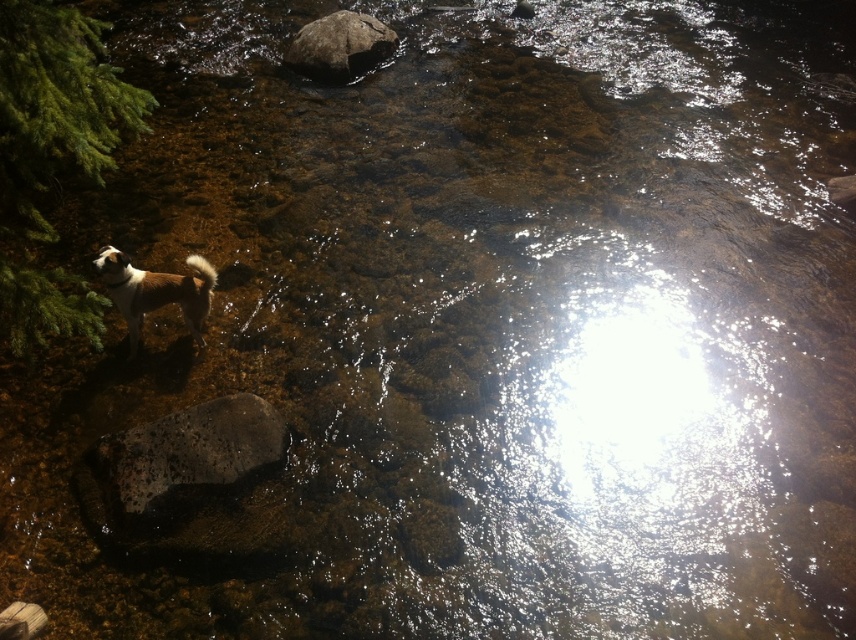
Does speckled gray rock at center have a smaller size compared to brown fur dog at left?

Yes, speckled gray rock at center is smaller than brown fur dog at left.

Which is below, speckled gray rock at center or brown fur dog at left?

speckled gray rock at center is lower down.

You are a GUI agent. You are given a task and a screenshot of the screen. Output one action in this format:
    pyautogui.click(x=<x>, y=<y>)
    Task: Click on the speckled gray rock at center
    Image resolution: width=856 pixels, height=640 pixels.
    Given the screenshot: What is the action you would take?
    pyautogui.click(x=189, y=452)

Which is in front, point (203, 317) or point (300, 56)?

Point (203, 317) is more forward.

Who is positioned more to the left, brown fur dog at left or smooth gray rock at upper center?

From the viewer's perspective, brown fur dog at left appears more on the left side.

What do you see at coordinates (155, 291) in the screenshot? I see `brown fur dog at left` at bounding box center [155, 291].

At what (x,y) coordinates should I click in order to perform the action: click on brown fur dog at left. Please return your answer as a coordinate pair (x, y). Looking at the image, I should click on (155, 291).

Between point (260, 442) and point (363, 19), which one is positioned in front?

Point (260, 442) is in front.

Which of these two, speckled gray rock at center or smooth gray rock at upper center, stands shorter?

With less height is speckled gray rock at center.

Does point (102, 444) come closer to viewer compared to point (308, 33)?

Yes, point (102, 444) is in front of point (308, 33).

The image size is (856, 640). I want to click on speckled gray rock at center, so click(x=189, y=452).